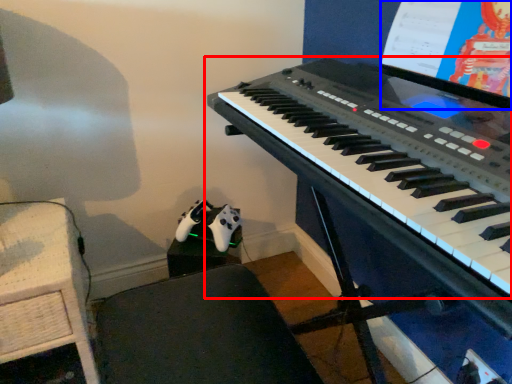
Question: Which of the following is the farthest to the observer, musical keyboard (highlighted by a red box) or computer screen (highlighted by a blue box)?

Choices:
 (A) musical keyboard
 (B) computer screen

Answer: (B)